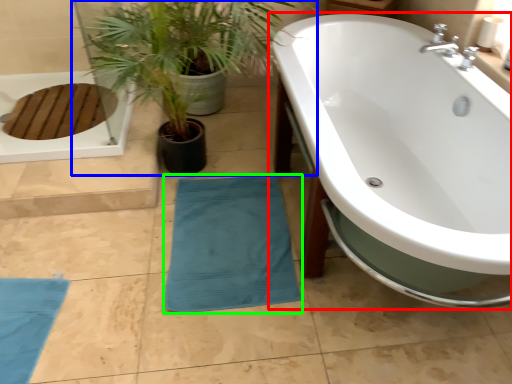
Question: Which object is the closest to the bathtub (highlighted by a red box)? Choose among these: houseplant (highlighted by a blue box) or beach towel (highlighted by a green box).

Choices:
 (A) houseplant
 (B) beach towel

Answer: (B)